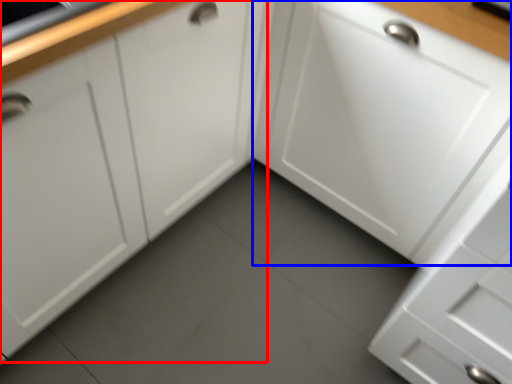
Question: Among these objects, which one is nearest to the camera, cabinetry (highlighted by a red box) or cabinetry (highlighted by a blue box)?

Choices:
 (A) cabinetry
 (B) cabinetry

Answer: (A)